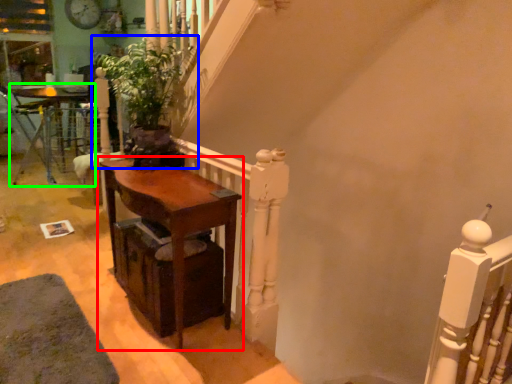
Question: Which object is positioned farthest from table (highlighted by a red box)? Select from houseplant (highlighted by a blue box) and table (highlighted by a green box).

Choices:
 (A) houseplant
 (B) table

Answer: (B)